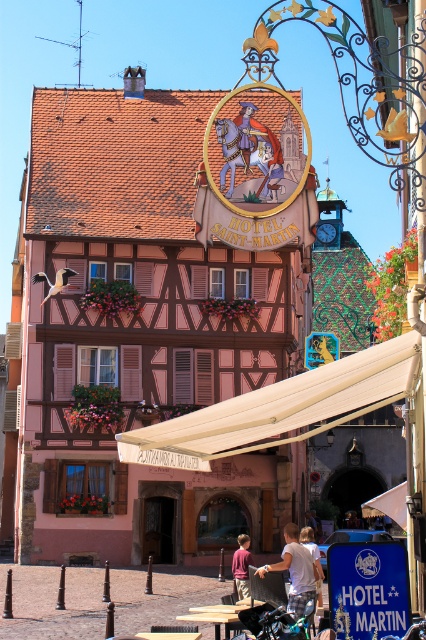
From the picture: Does beige fabric canopy at center appear over white cotton shirt at center?

Correct, beige fabric canopy at center is located above white cotton shirt at center.

Locate an element on the screen. The image size is (426, 640). beige fabric canopy at center is located at coordinates (279, 408).

Where is `beige fabric canopy at center`? beige fabric canopy at center is located at coordinates (279, 408).

Is white cotton shirt at lower center to the left of white cotton shirt at center from the viewer's perspective?

Yes, white cotton shirt at lower center is to the left of white cotton shirt at center.

The width and height of the screenshot is (426, 640). I want to click on white cotton shirt at lower center, so click(296, 570).

Is point (296, 609) positioned in front of point (307, 529)?

Yes, it is in front of point (307, 529).

At what (x,y) coordinates should I click in order to perform the action: click on white cotton shirt at lower center. Please return your answer as a coordinate pair (x, y). Image resolution: width=426 pixels, height=640 pixels. Looking at the image, I should click on 296,570.

Where is `maroon shirt at center`? Image resolution: width=426 pixels, height=640 pixels. maroon shirt at center is located at coordinates (241, 564).

Does maroon shirt at center have a larger size compared to white cotton shirt at center?

Incorrect, maroon shirt at center is not larger than white cotton shirt at center.

Image resolution: width=426 pixels, height=640 pixels. Identify the location of maroon shirt at center. (241, 564).

Locate an element on the screen. The image size is (426, 640). maroon shirt at center is located at coordinates pos(241,564).